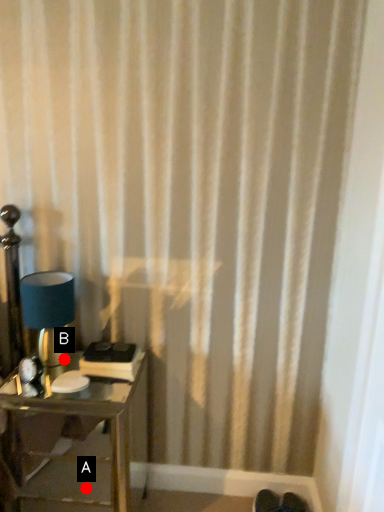
Question: Two points are circled on the image, labeled by A and B beside each circle. Among these points, which one is nearest to the camera?

Choices:
 (A) A is closer
 (B) B is closer

Answer: (B)